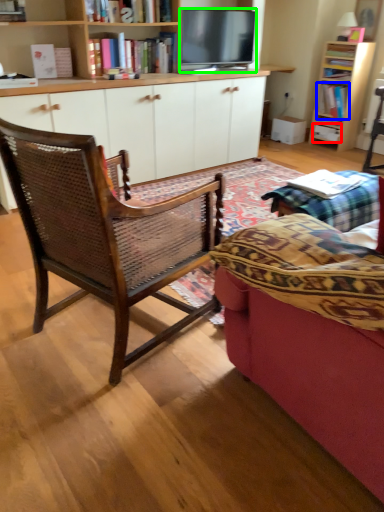
Question: Which is nearer to the drawer (highlighted by a red box)? book (highlighted by a blue box) or television (highlighted by a green box).

Choices:
 (A) book
 (B) television

Answer: (A)